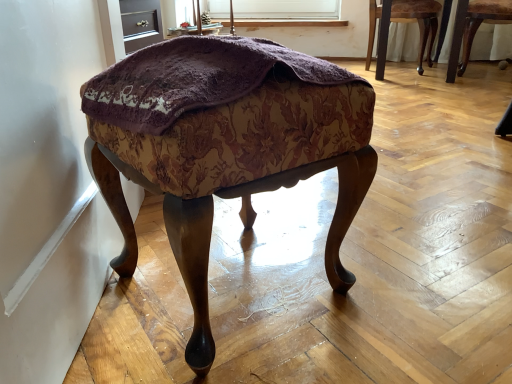
What is the approximate width of wooden chair at right, arranged as the 1th chair when viewed from the right?

The width of wooden chair at right, arranged as the 1th chair when viewed from the right, is 15.68 inches.

Find the location of a particular element. This screenshot has width=512, height=384. velvet-like fabric stool at center is located at coordinates (225, 145).

Does wooden chair at upper right, which is counted as the 2th chair, starting from the right, lie in front of matte purple fabric at upper center?

Yes, wooden chair at upper right, which is counted as the 2th chair, starting from the right, is closer to the viewer.

Which object is positioned more to the left, wooden chair at upper right, the first chair viewed from the left, or matte purple fabric at upper center?

From the viewer's perspective, matte purple fabric at upper center appears more on the left side.

Does point (422, 47) lie in front of point (206, 26)?

Yes, point (422, 47) is closer to viewer.

Is wooden chair at upper right, the first chair viewed from the left, facing away from matte purple fabric at upper center?

That's not correct — wooden chair at upper right, the first chair viewed from the left, is not looking away from matte purple fabric at upper center.

Is velvet-like fabric stool at center positioned with its back to matte purple fabric at upper center?

No, velvet-like fabric stool at center is not facing away from matte purple fabric at upper center.

Is velvet-like fabric stool at center bigger or smaller than matte purple fabric at upper center?

In the image, velvet-like fabric stool at center appears to be larger than matte purple fabric at upper center.

Is velvet-like fabric stool at center beside matte purple fabric at upper center?

No, velvet-like fabric stool at center is not beside matte purple fabric at upper center.

Does velvet-like fabric stool at center appear on the right side of matte purple fabric at upper center?

Correct, you'll find velvet-like fabric stool at center to the right of matte purple fabric at upper center.

Who is taller, wooden chair at upper right, which is counted as the 2th chair, starting from the right, or velvet-like fabric stool at center?

wooden chair at upper right, which is counted as the 2th chair, starting from the right.

Are wooden chair at upper right, which is counted as the 2th chair, starting from the right, and velvet-like fabric stool at center beside each other?

wooden chair at upper right, which is counted as the 2th chair, starting from the right, is not next to velvet-like fabric stool at center, and they're not touching.

From a real-world perspective, is wooden chair at upper right, the first chair viewed from the left, physically located above or below velvet-like fabric stool at center?

wooden chair at upper right, the first chair viewed from the left, is situated higher than velvet-like fabric stool at center in the real world.

Is wooden chair at upper right, which is counted as the 2th chair, starting from the right, to the right of velvet-like fabric stool at center from the viewer's perspective?

Indeed, wooden chair at upper right, which is counted as the 2th chair, starting from the right, is positioned on the right side of velvet-like fabric stool at center.

Locate an element on the screen. The height and width of the screenshot is (384, 512). chair to the right of wooden chair at upper right, the first chair viewed from the left is located at coordinates (481, 23).

Which is in front, point (480, 8) or point (407, 17)?

Positioned in front is point (480, 8).

Consider the image. Which object is wider, wooden chair at right, arranged as the 1th chair when viewed from the right, or wooden chair at upper right, the first chair viewed from the left?

With larger width is wooden chair at upper right, the first chair viewed from the left.

Is wooden chair at right, arranged as the 1th chair when viewed from the right, far from wooden chair at upper right, which is counted as the 2th chair, starting from the right?

No, wooden chair at right, arranged as the 1th chair when viewed from the right, is not far from wooden chair at upper right, which is counted as the 2th chair, starting from the right.

I want to click on stool that appears below the matte purple fabric at upper center (from the image's perspective), so click(225, 145).

Can you tell me how much matte purple fabric at upper center and velvet-like fabric stool at center differ in facing direction?

89.1 degrees.

Considering the relative sizes of matte purple fabric at upper center and velvet-like fabric stool at center in the image provided, is matte purple fabric at upper center taller than velvet-like fabric stool at center?

No.

Considering the sizes of objects velvet-like fabric stool at center and wooden chair at right, marked as the second chair in a left-to-right arrangement, in the image provided, who is taller, velvet-like fabric stool at center or wooden chair at right, marked as the second chair in a left-to-right arrangement,?

Standing taller between the two is velvet-like fabric stool at center.

Is there a large distance between velvet-like fabric stool at center and wooden chair at right, arranged as the 1th chair when viewed from the right?

Yes.

Based on their sizes in the image, would you say velvet-like fabric stool at center is bigger or smaller than wooden chair at right, arranged as the 1th chair when viewed from the right?

velvet-like fabric stool at center is bigger than wooden chair at right, arranged as the 1th chair when viewed from the right.

Is wooden chair at upper right, which is counted as the 2th chair, starting from the right, looking in the opposite direction of wooden chair at right, marked as the second chair in a left-to-right arrangement?

wooden chair at upper right, which is counted as the 2th chair, starting from the right, is not turned away from wooden chair at right, marked as the second chair in a left-to-right arrangement.

Looking at this image, considering the sizes of objects wooden chair at upper right, which is counted as the 2th chair, starting from the right, and wooden chair at right, marked as the second chair in a left-to-right arrangement, in the image provided, who is smaller, wooden chair at upper right, which is counted as the 2th chair, starting from the right, or wooden chair at right, marked as the second chair in a left-to-right arrangement,?

Smaller between the two is wooden chair at right, marked as the second chair in a left-to-right arrangement.

Considering the relative sizes of wooden chair at upper right, the first chair viewed from the left, and wooden chair at right, arranged as the 1th chair when viewed from the right, in the image provided, is wooden chair at upper right, the first chair viewed from the left, shorter than wooden chair at right, arranged as the 1th chair when viewed from the right,?

Incorrect, the height of wooden chair at upper right, the first chair viewed from the left, does not fall short of that of wooden chair at right, arranged as the 1th chair when viewed from the right.

Looking at their sizes, would you say wooden chair at upper right, which is counted as the 2th chair, starting from the right, is wider or thinner than wooden chair at right, arranged as the 1th chair when viewed from the right?

Clearly, wooden chair at upper right, which is counted as the 2th chair, starting from the right, has more width compared to wooden chair at right, arranged as the 1th chair when viewed from the right.

At what (x,y) coordinates should I click in order to perform the action: click on chair that is the 1st object located in front of the matte purple fabric at upper center. Please return your answer as a coordinate pair (x, y). Looking at the image, I should click on (419, 22).

The image size is (512, 384). What are the coordinates of `side table on the left of velvet-like fabric stool at center` in the screenshot? It's located at (182, 31).

From the image, which object appears to be nearer to matte purple fabric at upper center, wooden chair at right, marked as the second chair in a left-to-right arrangement, or velvet-like fabric stool at center?

wooden chair at right, marked as the second chair in a left-to-right arrangement, lies closer to matte purple fabric at upper center than the other object.

Based on the photo, from the image, which object appears to be farther from matte purple fabric at upper center, wooden chair at upper right, which is counted as the 2th chair, starting from the right, or velvet-like fabric stool at center?

The object further to matte purple fabric at upper center is velvet-like fabric stool at center.

Looking at the image, which one is located closer to wooden chair at right, arranged as the 1th chair when viewed from the right, wooden chair at upper right, which is counted as the 2th chair, starting from the right, or matte purple fabric at upper center?

wooden chair at upper right, which is counted as the 2th chair, starting from the right, is closer to wooden chair at right, arranged as the 1th chair when viewed from the right.

When comparing their distances from matte purple fabric at upper center, does velvet-like fabric stool at center or wooden chair at right, marked as the second chair in a left-to-right arrangement, seem closer?

wooden chair at right, marked as the second chair in a left-to-right arrangement, is positioned closer to the anchor matte purple fabric at upper center.

Considering their positions, is wooden chair at right, arranged as the 1th chair when viewed from the right, positioned further to velvet-like fabric stool at center than matte purple fabric at upper center?

The object further to velvet-like fabric stool at center is wooden chair at right, arranged as the 1th chair when viewed from the right.

Looking at this image, when comparing their distances from matte purple fabric at upper center, does wooden chair at upper right, which is counted as the 2th chair, starting from the right, or wooden chair at right, arranged as the 1th chair when viewed from the right, seem closer?

Among the two, wooden chair at upper right, which is counted as the 2th chair, starting from the right, is located nearer to matte purple fabric at upper center.

From the image, which object appears to be nearer to wooden chair at right, arranged as the 1th chair when viewed from the right, wooden chair at upper right, which is counted as the 2th chair, starting from the right, or velvet-like fabric stool at center?

wooden chair at upper right, which is counted as the 2th chair, starting from the right, lies closer to wooden chair at right, arranged as the 1th chair when viewed from the right, than the other object.

From the image, which object appears to be farther from wooden chair at right, arranged as the 1th chair when viewed from the right, matte purple fabric at upper center or wooden chair at upper right, which is counted as the 2th chair, starting from the right?

Among the two, matte purple fabric at upper center is located further to wooden chair at right, arranged as the 1th chair when viewed from the right.

Where is `chair positioned between velvet-like fabric stool at center and wooden chair at upper right, the first chair viewed from the left, from near to far`? The width and height of the screenshot is (512, 384). chair positioned between velvet-like fabric stool at center and wooden chair at upper right, the first chair viewed from the left, from near to far is located at coordinates (481, 23).

This screenshot has width=512, height=384. In order to click on chair situated between matte purple fabric at upper center and wooden chair at right, marked as the second chair in a left-to-right arrangement, from left to right in this screenshot , I will do `click(419, 22)`.